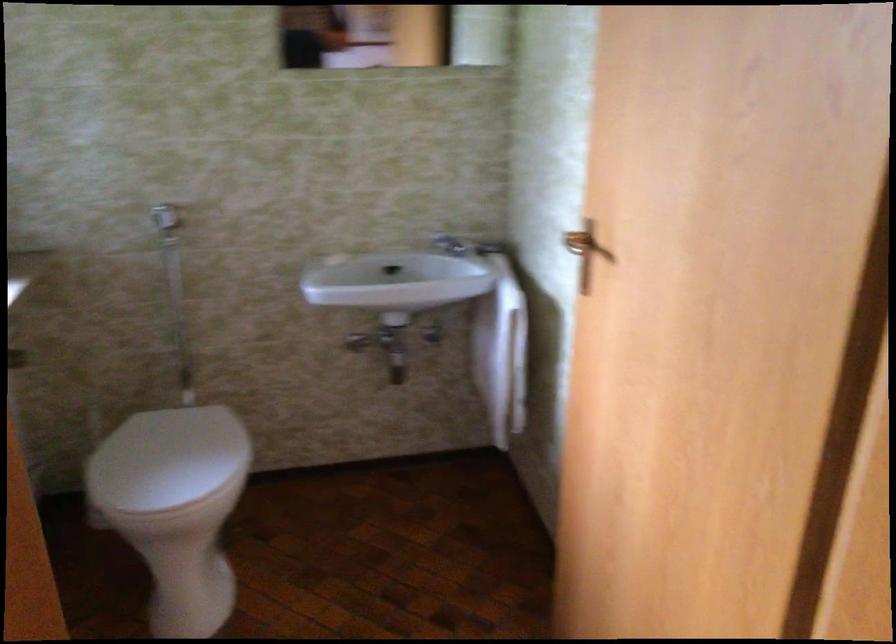
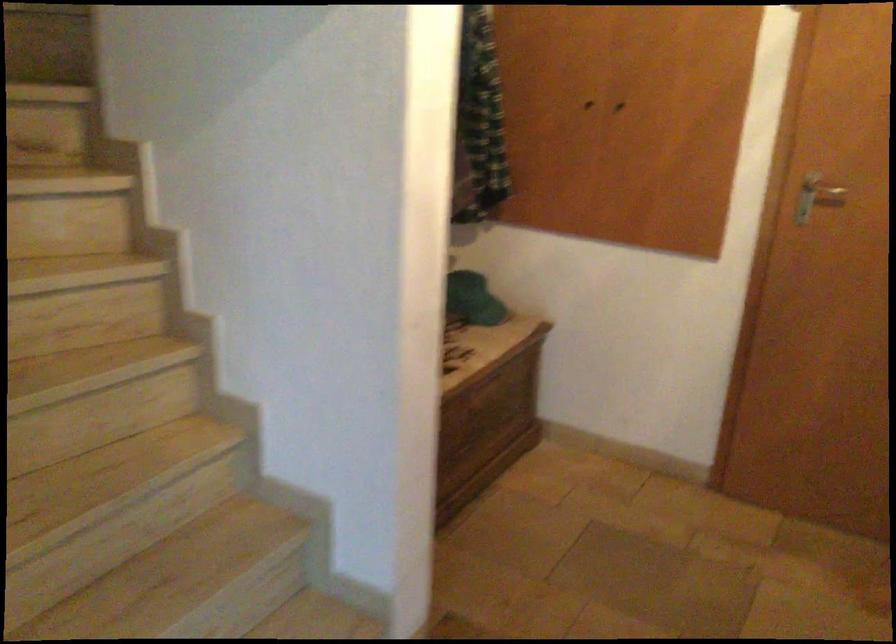
Question: The first image is from the beginning of the video and the second image is from the end. How did the camera likely rotate when shooting the video?

Choices:
 (A) Left
 (B) Right
 (C) Up
 (D) Down

Answer: (B)